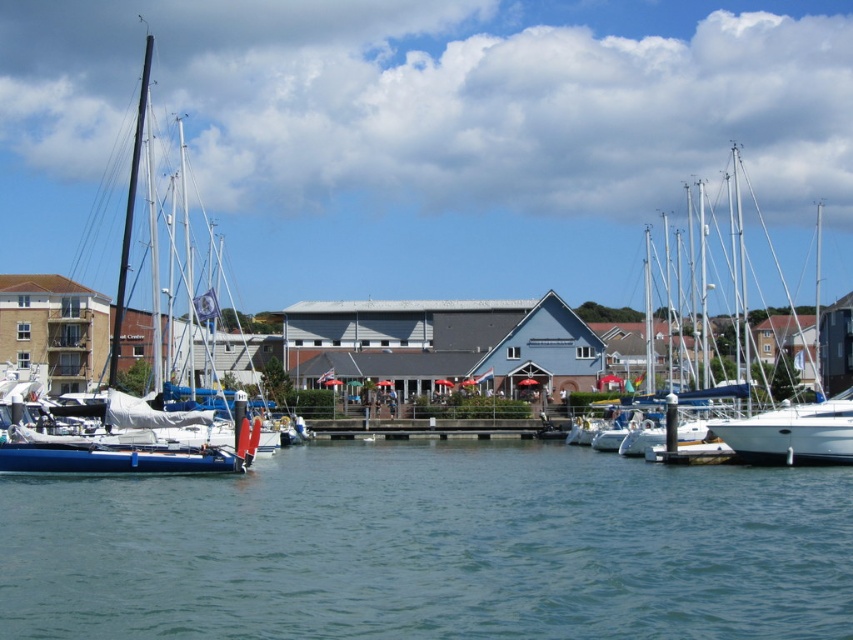
Question: Does clear blue water at center have a lesser width compared to white matte sailboat at left?

Choices:
 (A) no
 (B) yes

Answer: (B)

Question: Estimate the real-world distances between objects in this image. Which object is closer to the white glossy sailboat at right?

Choices:
 (A) clear blue water at center
 (B) white matte sailboat at left

Answer: (A)

Question: Which point appears farthest from the camera in this image?

Choices:
 (A) (733, 276)
 (B) (323, 484)
 (C) (10, 422)

Answer: (A)

Question: Is clear blue water at center bigger than white matte sailboat at left?

Choices:
 (A) yes
 (B) no

Answer: (B)

Question: Which of the following is the farthest from the observer?

Choices:
 (A) (141, 136)
 (B) (697, 385)
 (C) (15, 556)

Answer: (A)

Question: Can you confirm if white glossy sailboat at right is positioned below white matte sailboat at left?

Choices:
 (A) no
 (B) yes

Answer: (B)